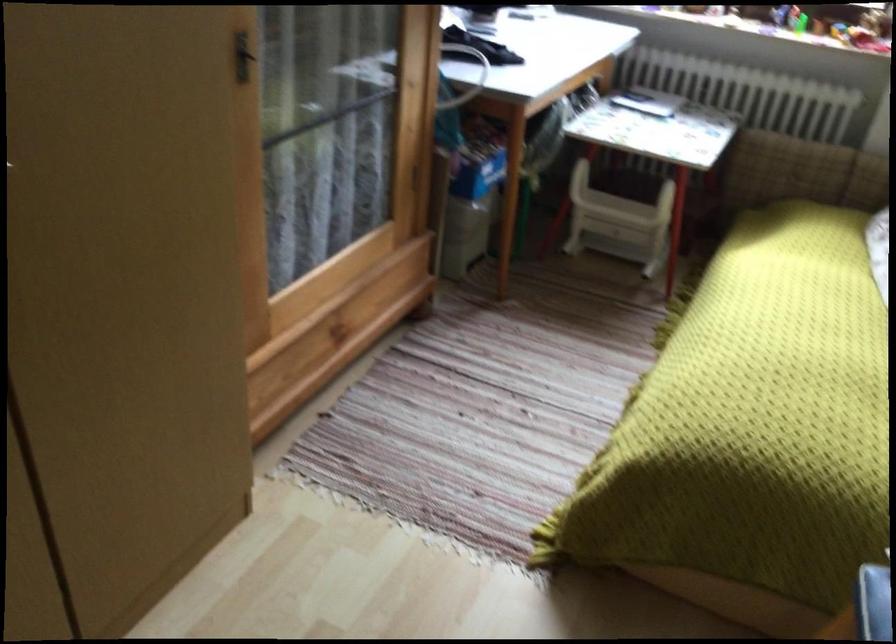
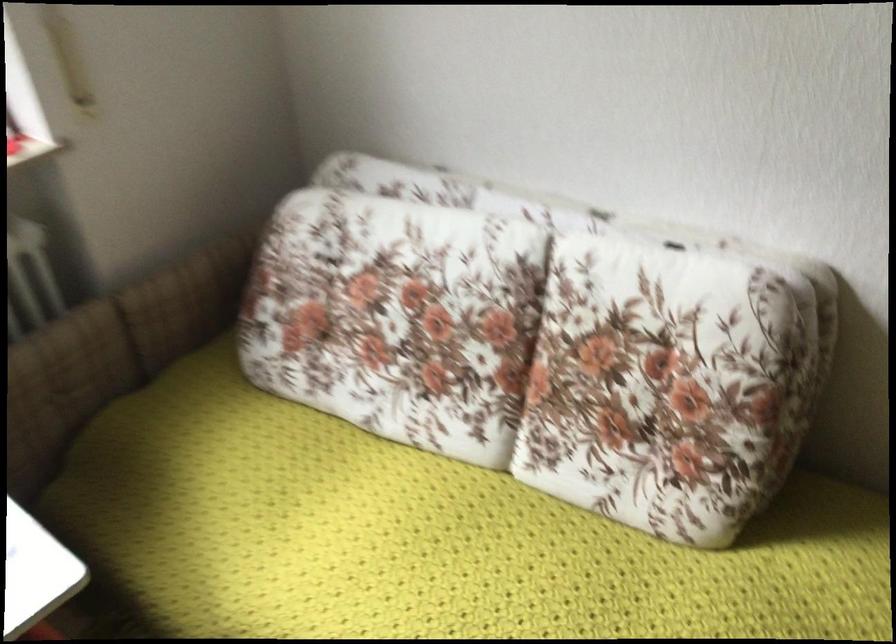
Locate, in the second image, the point that corresponds to [812,276] in the first image.

(429, 538)